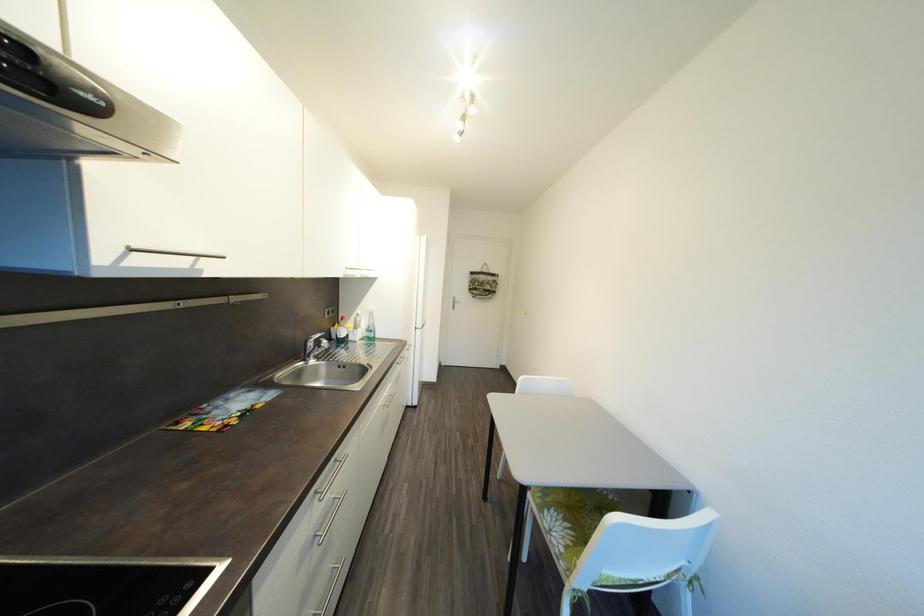
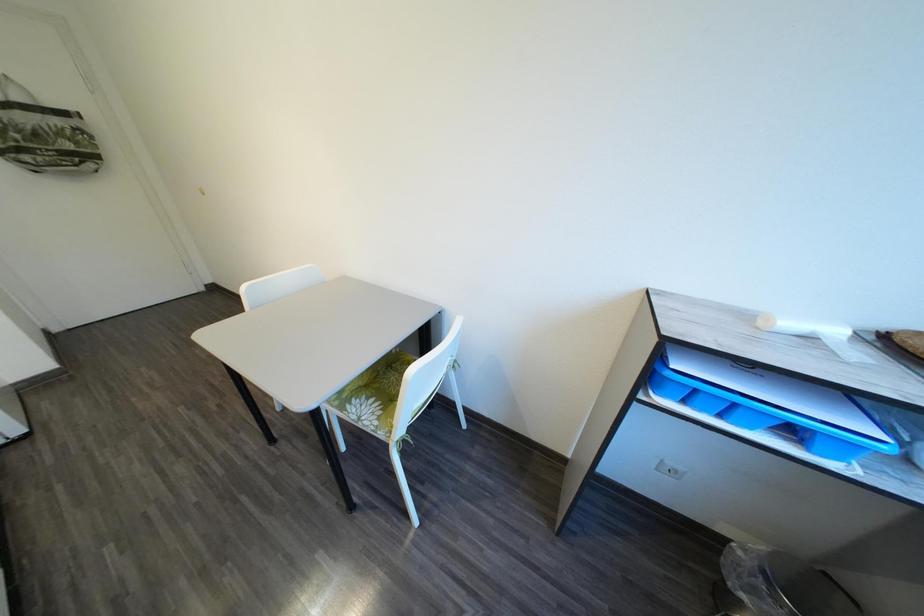
The first image is from the beginning of the video and the second image is from the end. How did the camera likely rotate when shooting the video?

The camera's rotation is toward right-down.